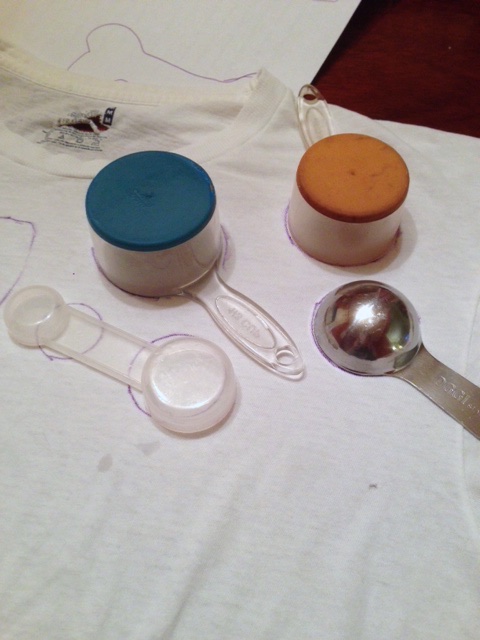
Where is `measuring spoon`? This screenshot has width=480, height=640. measuring spoon is located at coordinates (361, 314).